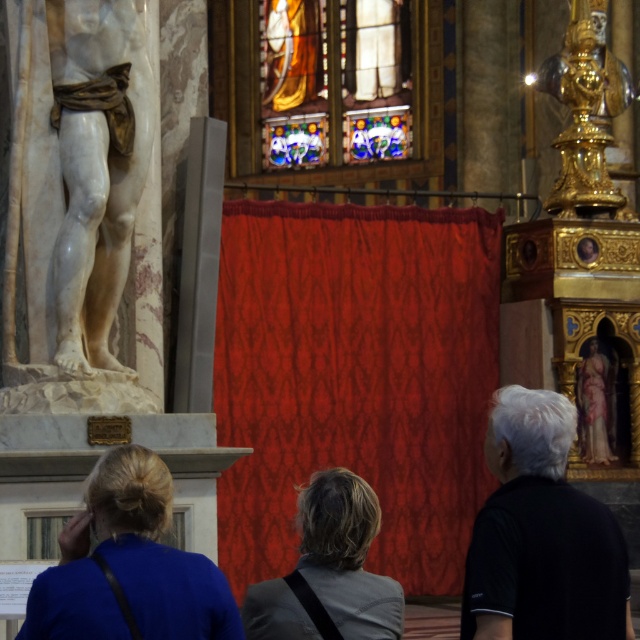
What is the coordinate of the stained glass window at upper center?

The stained glass window at upper center is located at coordinate point (333,81).